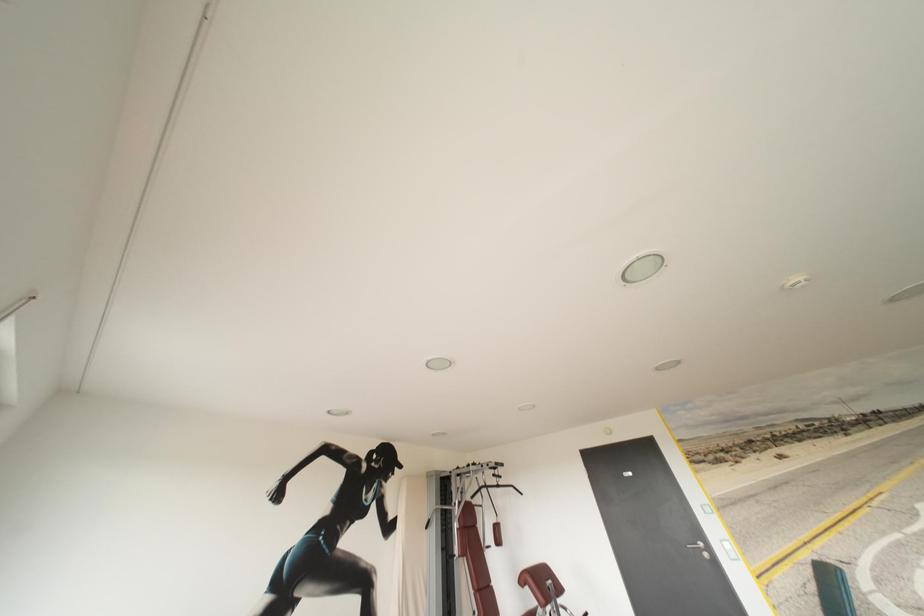
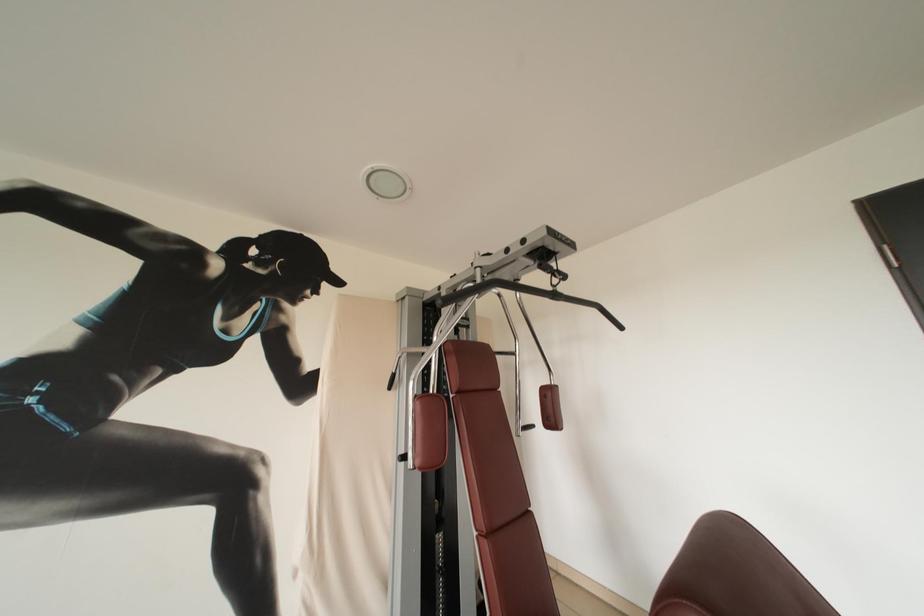
Question: What movement of the cameraman would produce the second image?

Choices:
 (A) Left
 (B) Right
 (C) Forward
 (D) Backward

Answer: (C)